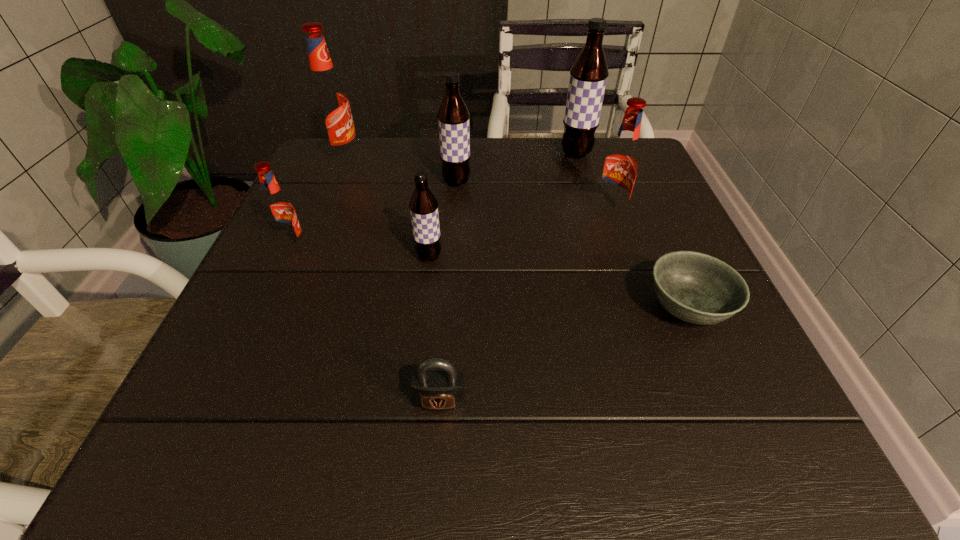
In the image, there is a desktop. At what (x,y) coordinates should I click in order to perform the action: click on free space at the near right corner. Please return your answer as a coordinate pair (x, y). The image size is (960, 540). Looking at the image, I should click on (666, 407).

Where is `empty space between the second farthest brown root beer and the farthest red root beer`? empty space between the second farthest brown root beer and the farthest red root beer is located at coordinates (400, 171).

Where is `free space between the rightmost brown root beer and the third farthest object`? free space between the rightmost brown root beer and the third farthest object is located at coordinates (516, 168).

Identify the location of vacant area between the farthest red root beer and the fourth nearest root beer. The height and width of the screenshot is (540, 960). (400, 171).

Where is `vacant area that lies between the seventh tallest object and the fourth farthest root beer`? Image resolution: width=960 pixels, height=540 pixels. vacant area that lies between the seventh tallest object and the fourth farthest root beer is located at coordinates tap(524, 307).

This screenshot has width=960, height=540. Find the location of `vacant area that lies between the nearest brown root beer and the second farthest brown root beer`. vacant area that lies between the nearest brown root beer and the second farthest brown root beer is located at coordinates (443, 219).

Find the location of `free space that is in between the farthest brown root beer and the gray bowl`. free space that is in between the farthest brown root beer and the gray bowl is located at coordinates (632, 231).

The image size is (960, 540). I want to click on free area in between the second nearest brown root beer and the nearest object, so click(448, 292).

At what (x,y) coordinates should I click in order to perform the action: click on vacant region between the fourth farthest object and the sixth nearest object. Please return your answer as a coordinate pair (x, y). The height and width of the screenshot is (540, 960). Looking at the image, I should click on pos(533,198).

Locate an element on the screen. This screenshot has width=960, height=540. blank region between the shortest object and the biggest red root beer is located at coordinates (515, 234).